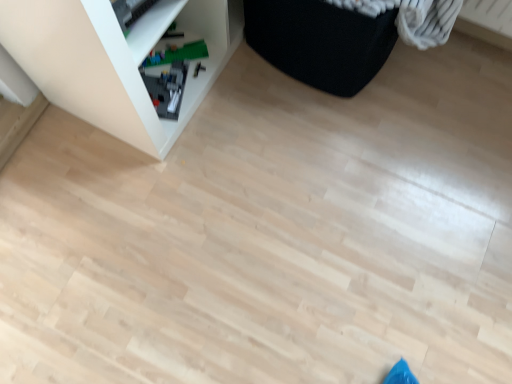
Question: Looking at the image, does green plastic toy at lower left seem bigger or smaller compared to black fabric ottoman at upper right?

Choices:
 (A) big
 (B) small

Answer: (B)

Question: Is point (166, 57) positioned closer to the camera than point (387, 31)?

Choices:
 (A) closer
 (B) farther

Answer: (B)

Question: Estimate the real-world distances between objects in this image. Which object is closer to the black fabric ottoman at upper right?

Choices:
 (A) green plastic toy at lower left
 (B) white plastic shelf at upper left

Answer: (B)

Question: Estimate the real-world distances between objects in this image. Which object is closer to the white plastic shelf at upper left?

Choices:
 (A) black fabric ottoman at upper right
 (B) green plastic toy at lower left

Answer: (B)